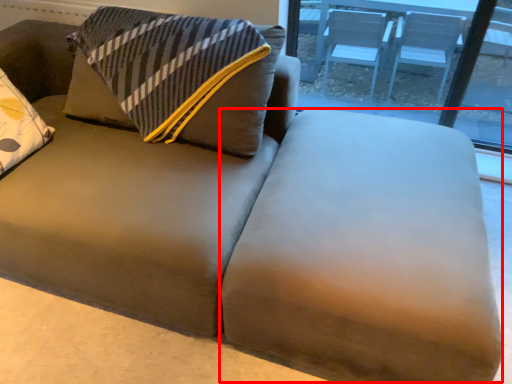
Question: From the image's perspective, where is flat (annotated by the red box) located in relation to window in the image?

Choices:
 (A) below
 (B) above

Answer: (A)